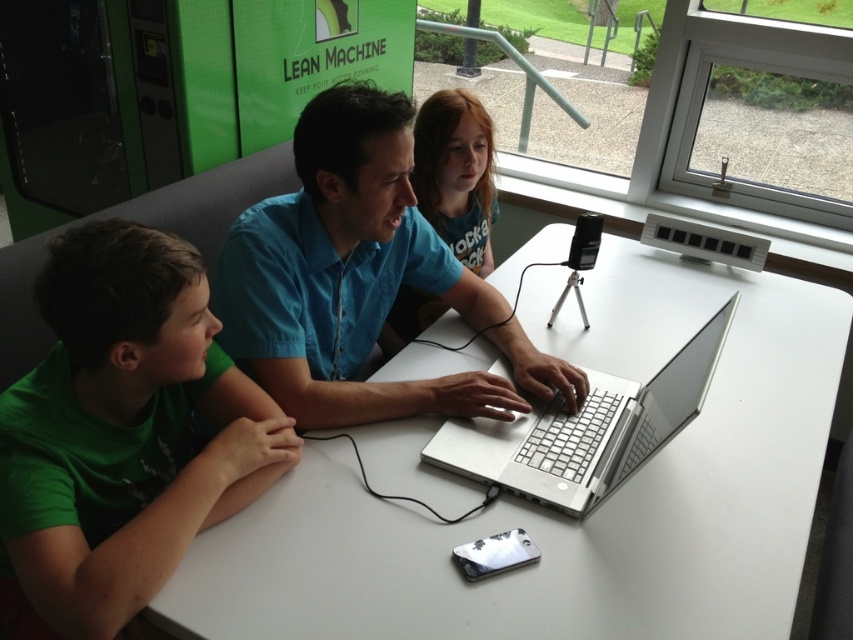
Which of these two, green matte shirt at left or silver metallic laptop at center, stands shorter?

silver metallic laptop at center is shorter.

Does point (115, 548) lie behind point (558, 406)?

No, (115, 548) is closer to viewer.

This screenshot has width=853, height=640. In order to click on green matte shirt at left in this screenshot , I will do `click(125, 429)`.

Can you confirm if white matte table at center is smaller than green matte shirt at left?

No.

You are a GUI agent. You are given a task and a screenshot of the screen. Output one action in this format:
    pyautogui.click(x=<x>, y=<y>)
    Task: Click on the white matte table at center
    This screenshot has width=853, height=640.
    Given the screenshot: What is the action you would take?
    pyautogui.click(x=563, y=515)

Is point (309, 557) positioned behind point (155, 308)?

Yes, point (309, 557) is farther from viewer.

In order to click on white matte table at center in this screenshot , I will do `click(563, 515)`.

Which is in front, point (123, 428) or point (457, 248)?

Point (123, 428)

Looking at this image, is green matte shirt at left positioned before matte blue shirt at center?

Yes, green matte shirt at left is closer to the viewer.

Is point (64, 230) less distant than point (433, 168)?

Yes, point (64, 230) is closer to viewer.

Where is `green matte shirt at left`? The width and height of the screenshot is (853, 640). green matte shirt at left is located at coordinates pos(125,429).